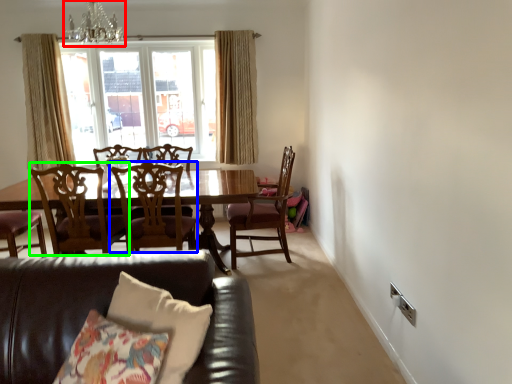
Question: Which object is the closest to the chandelier (highlighted by a red box)? Choose among these: chair (highlighted by a blue box) or chair (highlighted by a green box).

Choices:
 (A) chair
 (B) chair

Answer: (B)